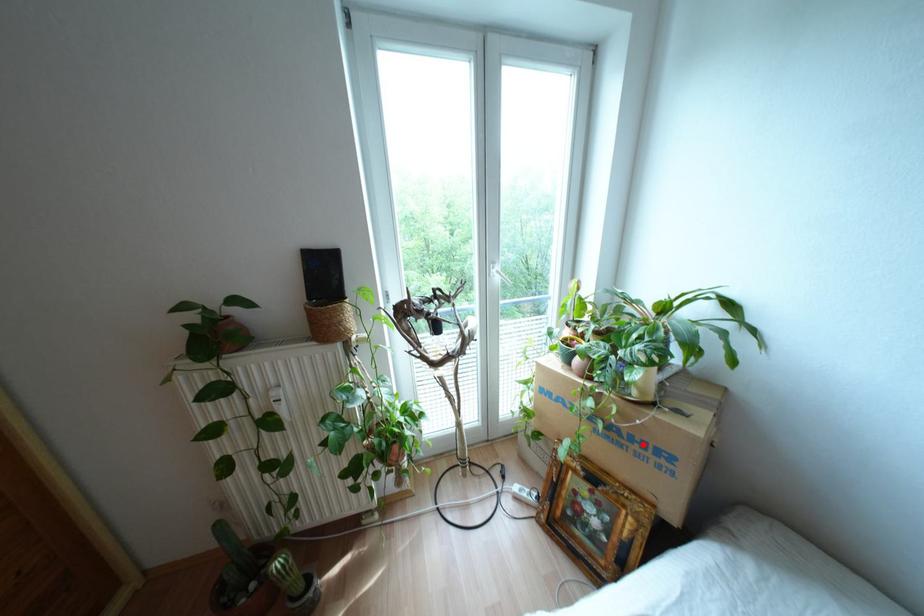
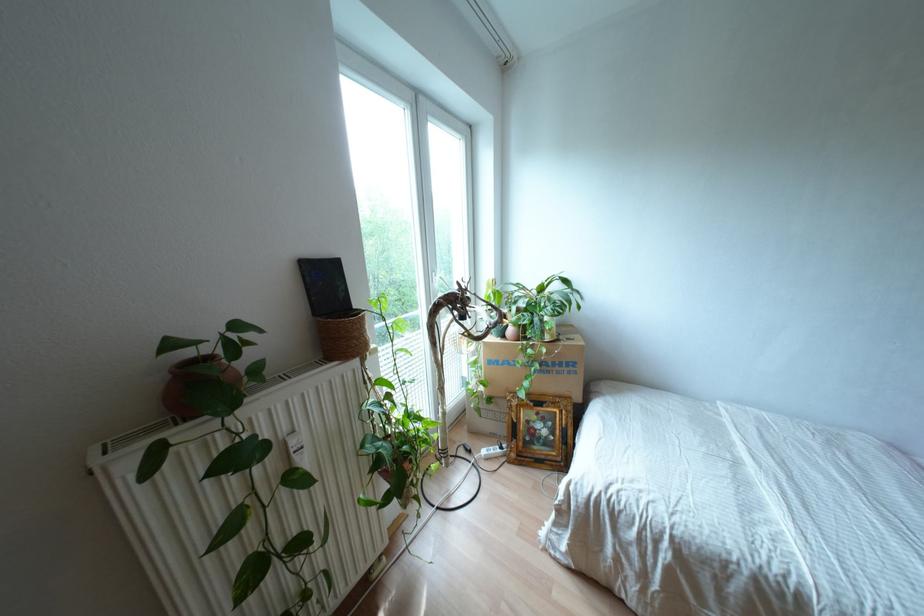
Locate, in the second image, the point that corresponds to the highlighted location in the first image.

(560, 363)